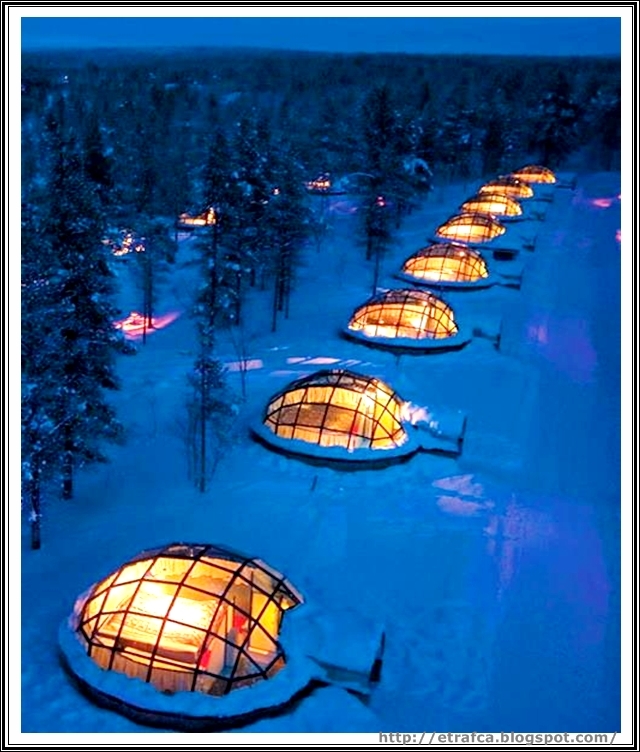
The width and height of the screenshot is (640, 752). What are the coordinates of `bed` in the screenshot? It's located at (172, 643).